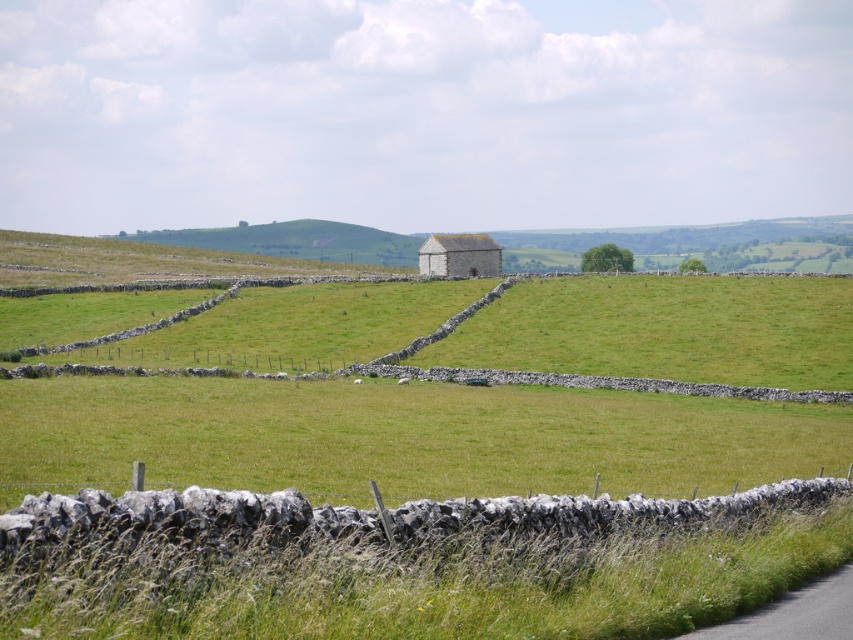
You are a farmer planning to mow the green grass at center and the white stone barn at center. Which area requires a wider mower to handle the width of the vegetation?

The green grass at center requires a wider mower since it is wider than the white stone barn at center according to the description.

You are standing in the rural landscape scene and want to walk towards the green grass at center and the white stone barn at center. Which object will you reach first?

You will reach the green grass at center first because it is closer to the viewer than the white stone barn at center.